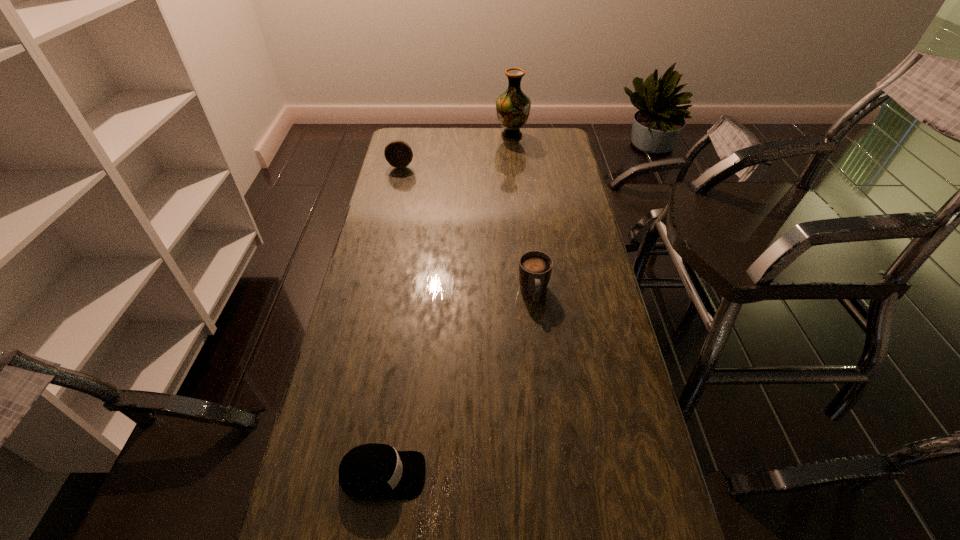
Select which object appears as the second closest to the farthest object. Please provide its 2D coordinates. Your answer should be formatted as a tuple, i.e. [(x, y)], where the tuple contains the x and y coordinates of a point satisfying the conditions above.

[(535, 267)]

Locate an element on the screen. The height and width of the screenshot is (540, 960). object that is the closest one to the shortest object is located at coordinates (535, 267).

Find the location of a particular element. The image size is (960, 540). vacant position in the image that satisfies the following two spatial constraints: 1. on the side of the second nearest object with the handle; 2. on the front-facing side of the cap is located at coordinates click(554, 475).